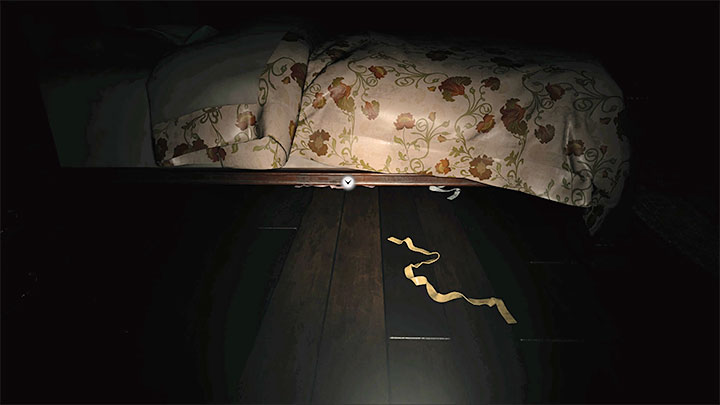
At what (x,y) coordinates should I click in order to perform the action: click on head of bed. Please return your answer as a coordinate pair (x, y). The height and width of the screenshot is (405, 720). Looking at the image, I should click on (37, 27).